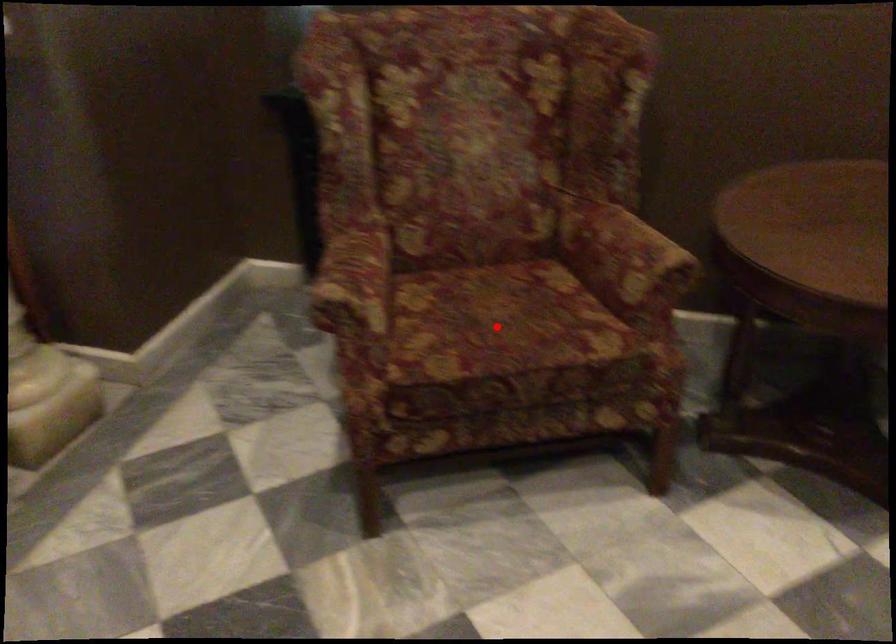
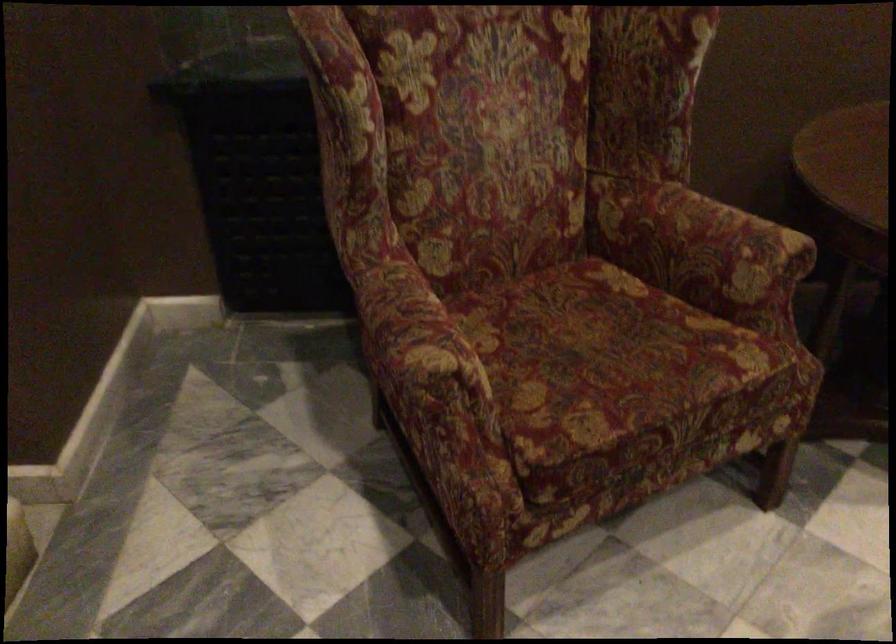
Where in the second image is the point corresponding to the highlighted location from the first image?

(606, 361)